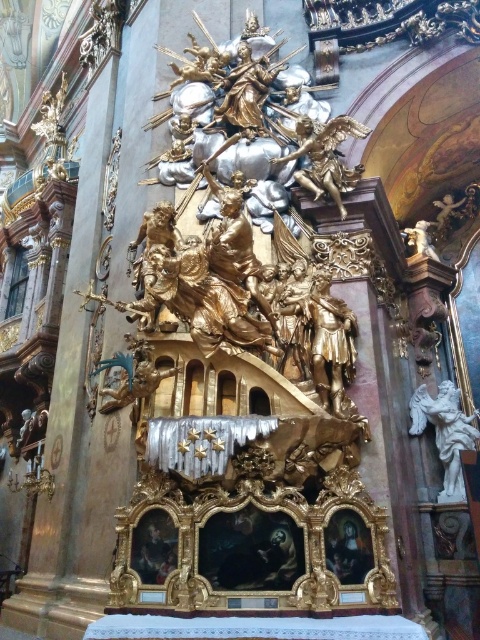
Question: Is the position of gold polished statue at upper center more distant than that of white marble angel at right?

Choices:
 (A) no
 (B) yes

Answer: (A)

Question: Which point is farther to the camera?

Choices:
 (A) white marble angel at right
 (B) gold polished statue at upper center

Answer: (A)

Question: Can you confirm if gold polished statue at upper center is positioned above white marble angel at right?

Choices:
 (A) yes
 (B) no

Answer: (A)

Question: Can you confirm if gold polished statue at upper center is thinner than white marble angel at right?

Choices:
 (A) yes
 (B) no

Answer: (A)

Question: Which object appears farthest from the camera in this image?

Choices:
 (A) gold polished statue at upper center
 (B) white marble angel at right

Answer: (B)